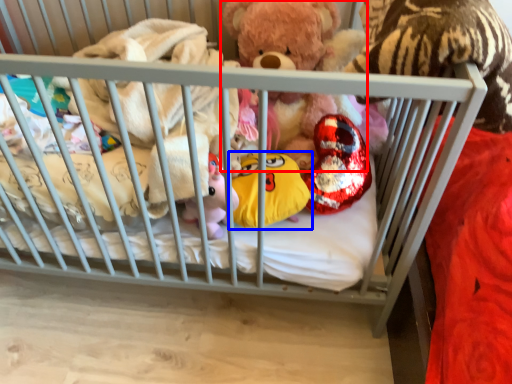
Question: Which object is further to the camera taking this photo, teddy bear (highlighted by a red box) or toy (highlighted by a blue box)?

Choices:
 (A) teddy bear
 (B) toy

Answer: (A)